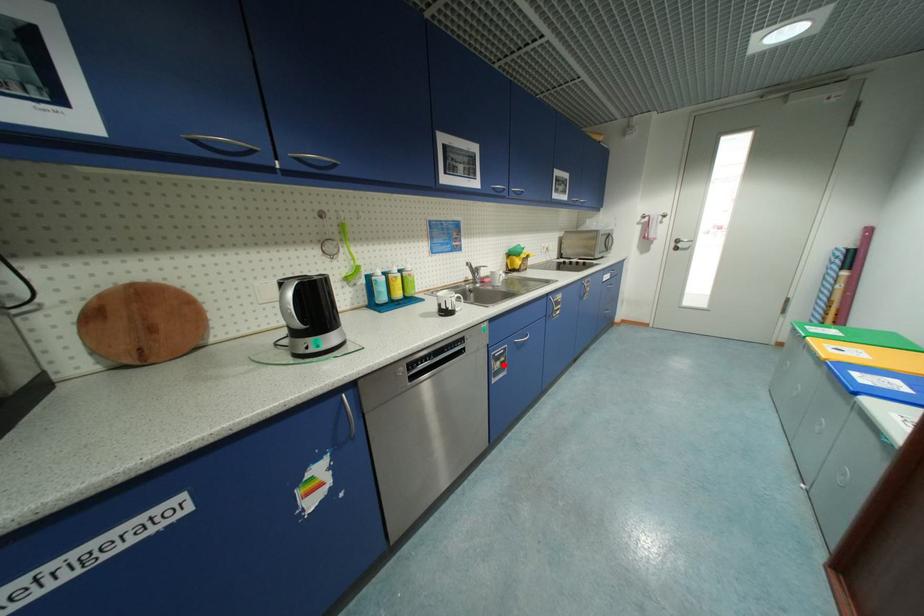
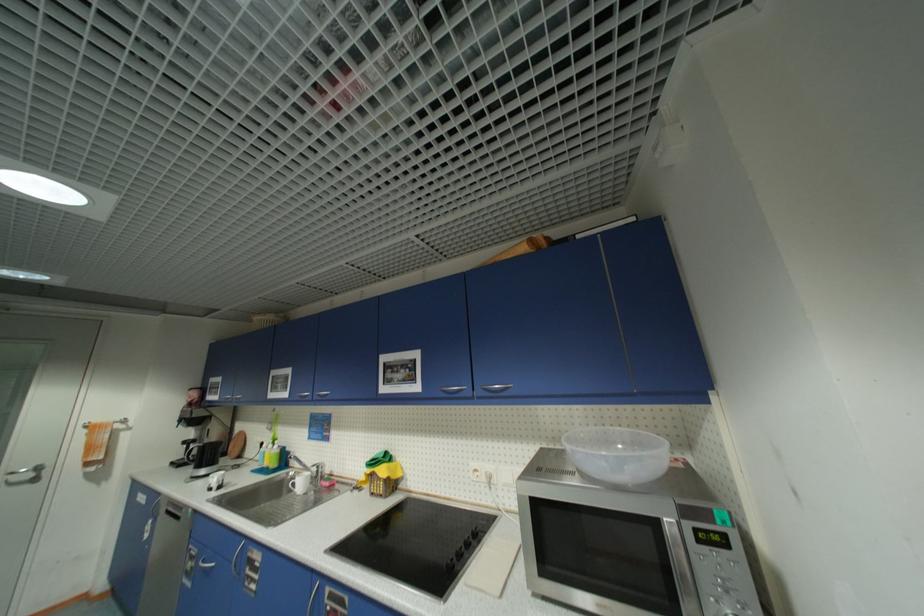
The point at the highlighted location is marked in the first image. Where is the corresponding point in the second image?

(196, 565)